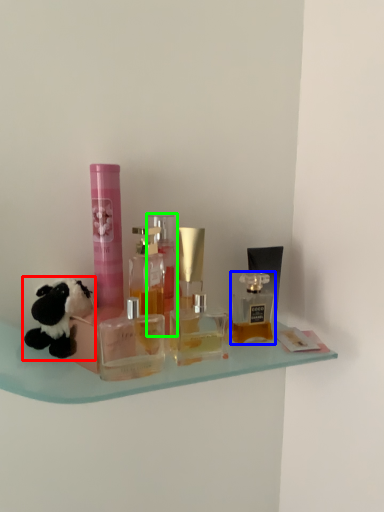
Question: Which is nearer to the toy (highlighted by a red box)? bottle (highlighted by a blue box) or bottle (highlighted by a green box).

Choices:
 (A) bottle
 (B) bottle

Answer: (B)